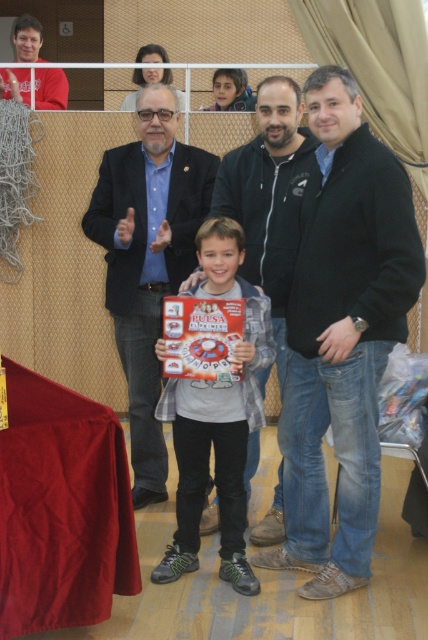
You are a photographer at the event and need to ensure that both the black matte jacket at center and the matte plastic board game at center are visible in the photo. Based on their heights, which one might you need to adjust your camera angle to capture properly?

The black matte jacket at center is much taller than the matte plastic board game at center, so you might need to lower your camera angle to ensure the jacket is fully visible while still capturing the board game in the frame.

You are standing in the gymnasium and want to reach the matte plastic board game at center. There is a black matte jacket at center in your way. Can you walk around it to get to the board game?

The black matte jacket at center is closer to the viewer than the matte plastic board game at center, so you can walk around the jacket to reach the board game.